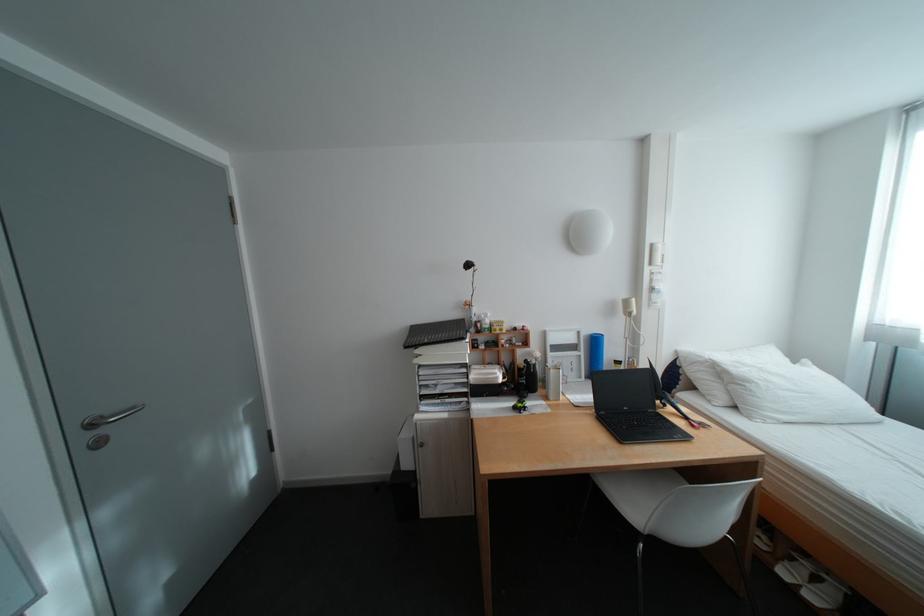
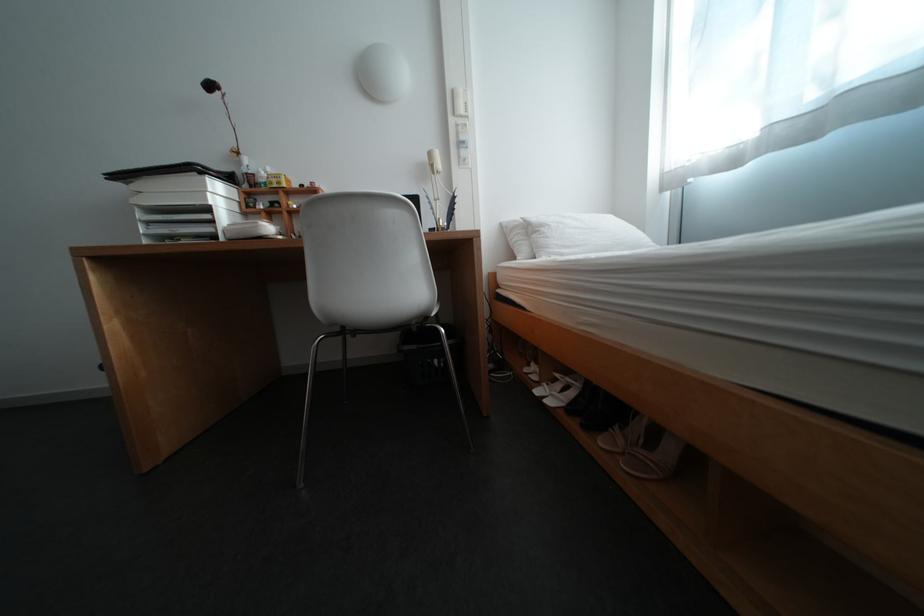
Question: What movement of the cameraman would produce the second image?

Choices:
 (A) Left
 (B) Right
 (C) Forward
 (D) Backward

Answer: (B)